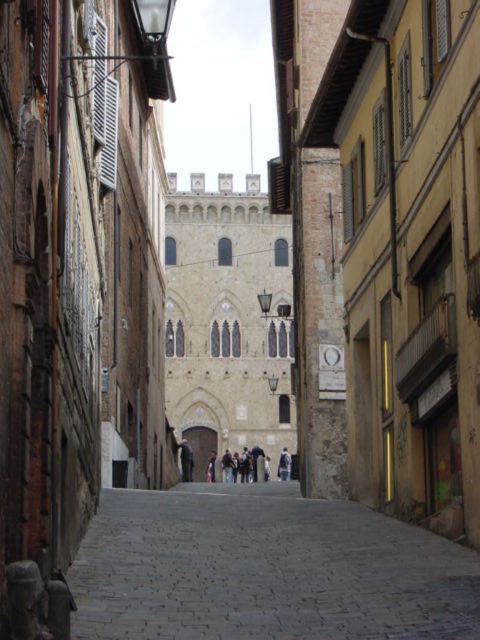
Question: Estimate the real-world distances between objects in this image. Which object is closer to the gray cobblestone path at center?

Choices:
 (A) light brown leather jacket at center
 (B) dark brown leather jacket at center

Answer: (A)

Question: Which of the following is the farthest from the observer?

Choices:
 (A) (189, 445)
 (B) (277, 465)
 (C) (362, 584)

Answer: (B)

Question: Is dark brown leather jacket at center positioned at the back of light brown leather jacket at center?

Choices:
 (A) no
 (B) yes

Answer: (B)

Question: Which of these objects is positioned farthest from the gray cobblestone path at center?

Choices:
 (A) light brown leather jacket at center
 (B) dark brown leather jacket at center

Answer: (B)

Question: Can you confirm if gray cobblestone path at center is wider than light brown leather jacket at center?

Choices:
 (A) yes
 (B) no

Answer: (A)

Question: Can you confirm if gray cobblestone path at center is positioned to the left of light brown leather jacket at center?

Choices:
 (A) yes
 (B) no

Answer: (A)